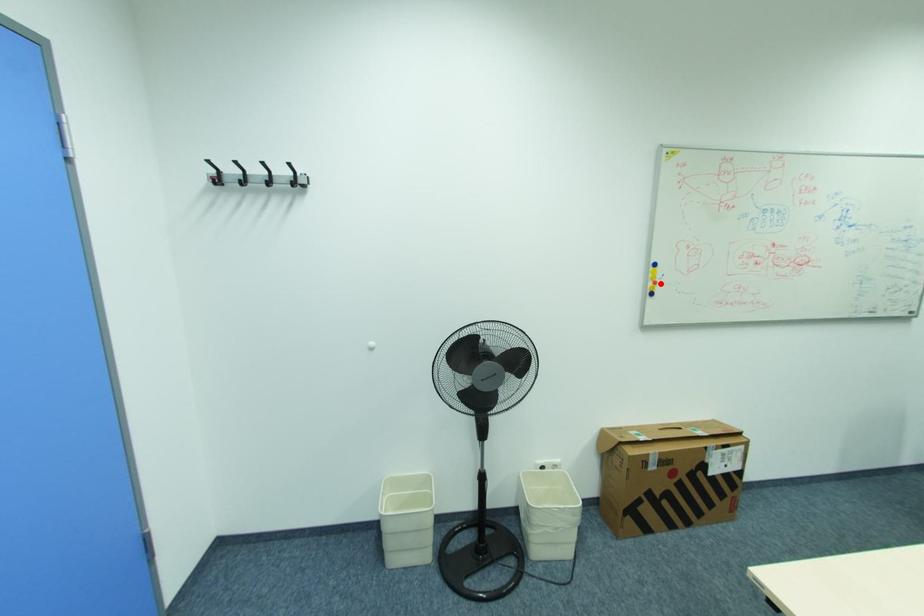
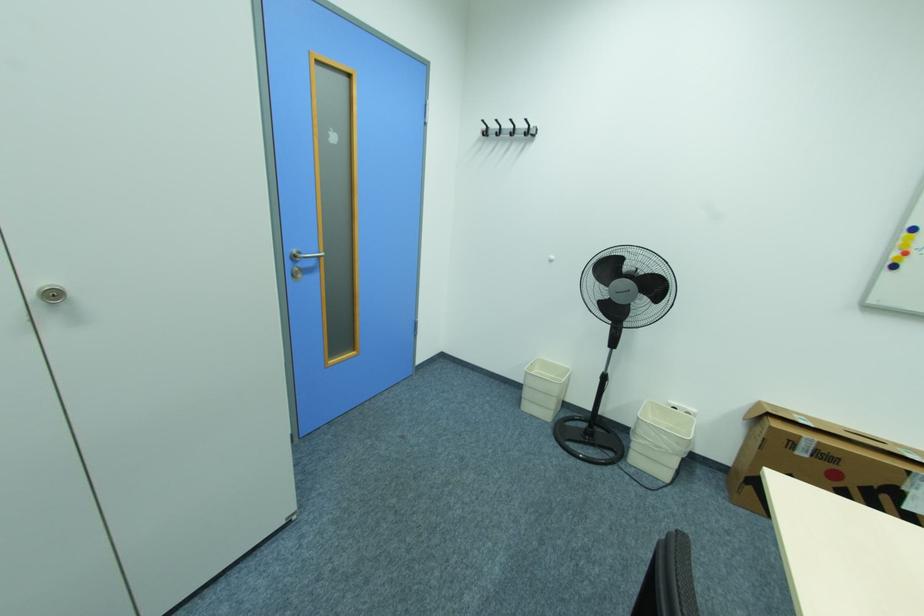
Where in the second image is the point corresponding to the highlighted location from the first image?

(910, 253)